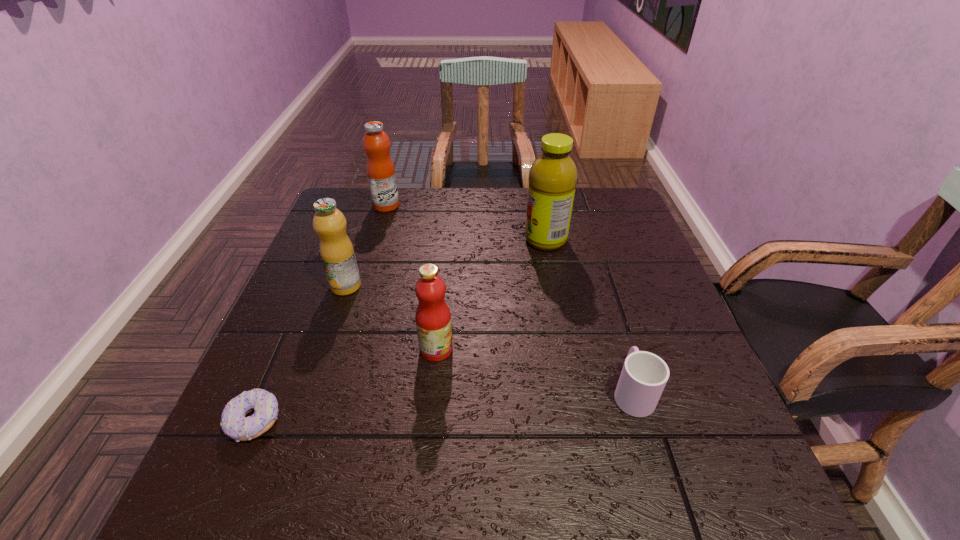
The height and width of the screenshot is (540, 960). I want to click on object located in the right edge section of the desktop, so click(x=644, y=375).

This screenshot has height=540, width=960. Identify the location of object located in the far left corner section of the desktop. (380, 169).

In the image, there is a desktop. Where is `free space at the far edge`? The image size is (960, 540). free space at the far edge is located at coordinates (415, 199).

In the image, there is a desktop. Where is `vacant space at the near edge`? vacant space at the near edge is located at coordinates (488, 513).

Locate an element on the screen. Image resolution: width=960 pixels, height=540 pixels. free spot at the left edge of the desktop is located at coordinates (288, 305).

The image size is (960, 540). I want to click on vacant space at the right edge of the desktop, so click(x=645, y=252).

At what (x,y) coordinates should I click in order to perform the action: click on free spot at the near right corner of the desktop. Please return your answer as a coordinate pair (x, y). This screenshot has width=960, height=540. Looking at the image, I should click on (754, 469).

Identify the location of empty space that is in between the second farthest fruit juice and the rightmost object. (588, 316).

Where is `free space between the cup and the third nearest object`? This screenshot has width=960, height=540. free space between the cup and the third nearest object is located at coordinates (534, 370).

I want to click on vacant space that's between the farthest object and the third fruit juice from left to right, so click(411, 278).